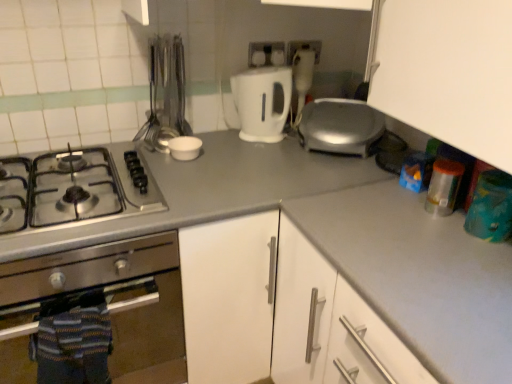
The width and height of the screenshot is (512, 384). I want to click on vacant region to the left of white matte bowl at center, so click(x=151, y=148).